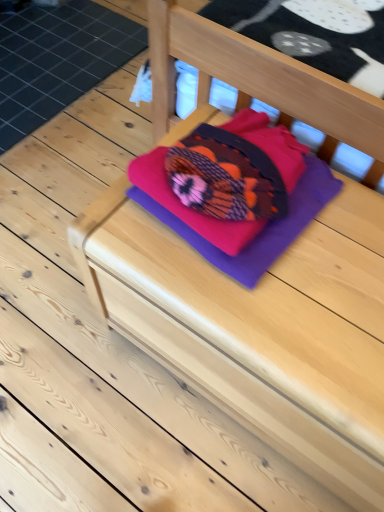
The height and width of the screenshot is (512, 384). Identify the location of empty space that is ontop of purple matte drawer at center (from a real-world perspective). (287, 271).